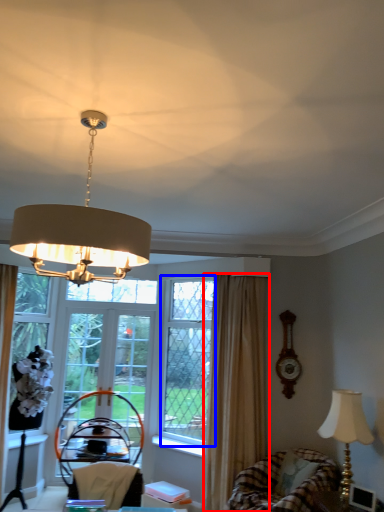
Question: Which object is closer to the camera taking this photo, curtain (highlighted by a red box) or window screen (highlighted by a blue box)?

Choices:
 (A) curtain
 (B) window screen

Answer: (A)